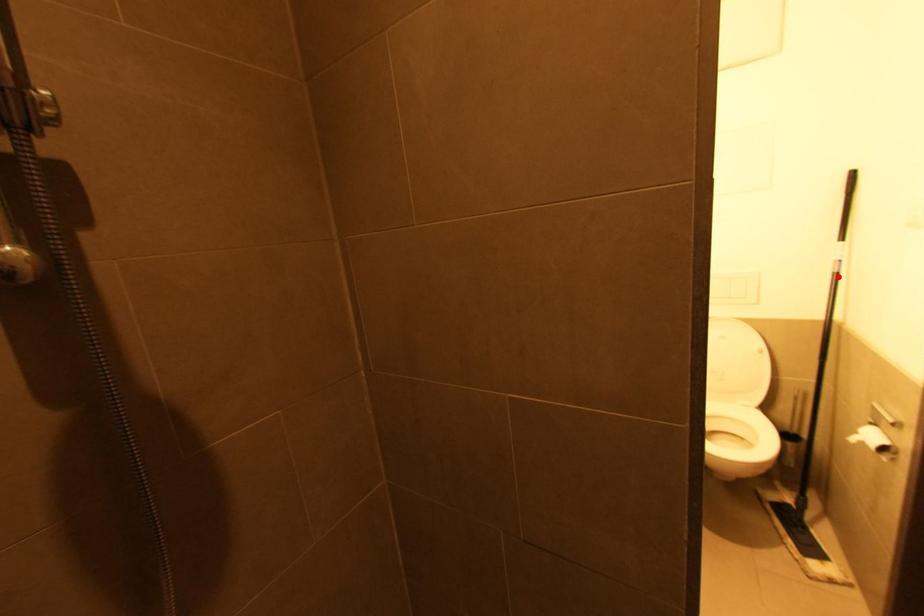
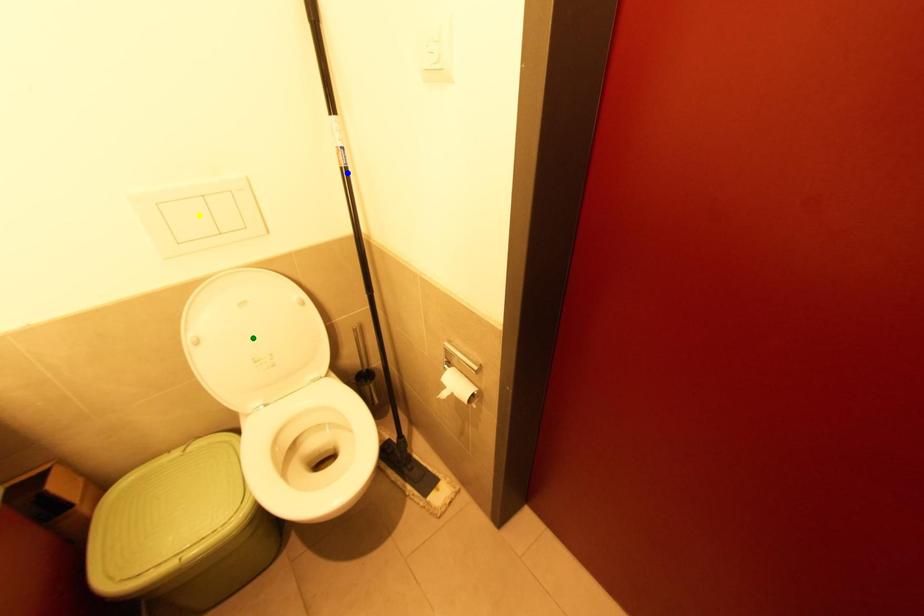
Question: I am providing you with two images of the same scene from different viewpoints. A red point is marked on the first image. You are given multiple points on the second image. Which mark in image 2 goes with the point in image 1?

Choices:
 (A) yellow point
 (B) green point
 (C) blue point

Answer: (C)